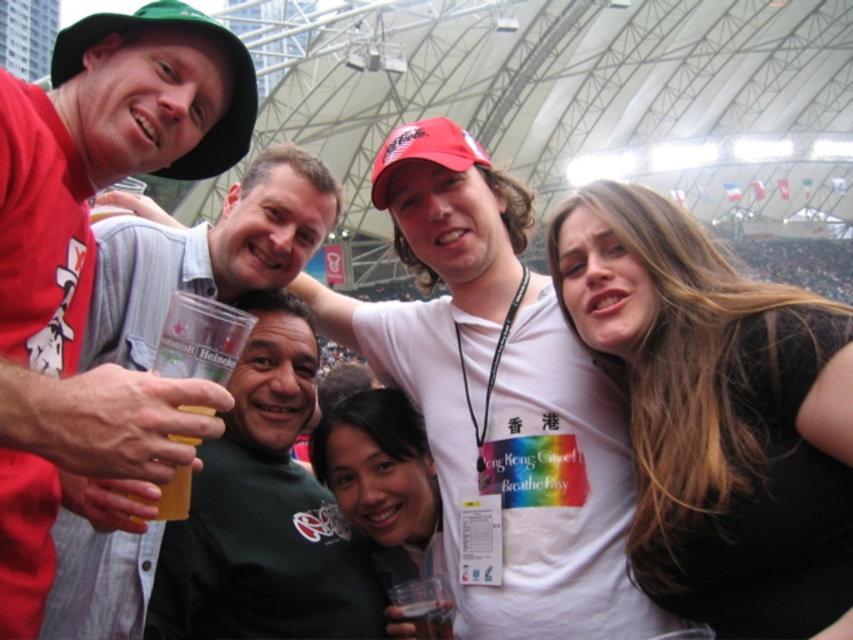
What object is located at the coordinates point (500, 397)?

The point (500, 397) corresponds to the white cotton t shirt at center.

You are standing at the center of the image and want to move towards the two points labeled as point (405, 179) and point (584, 250). Which point should you walk towards first if you want to reach the closer one first?

You should walk towards point (405, 179) first because it is closer to you than point (584, 250), which is further away.